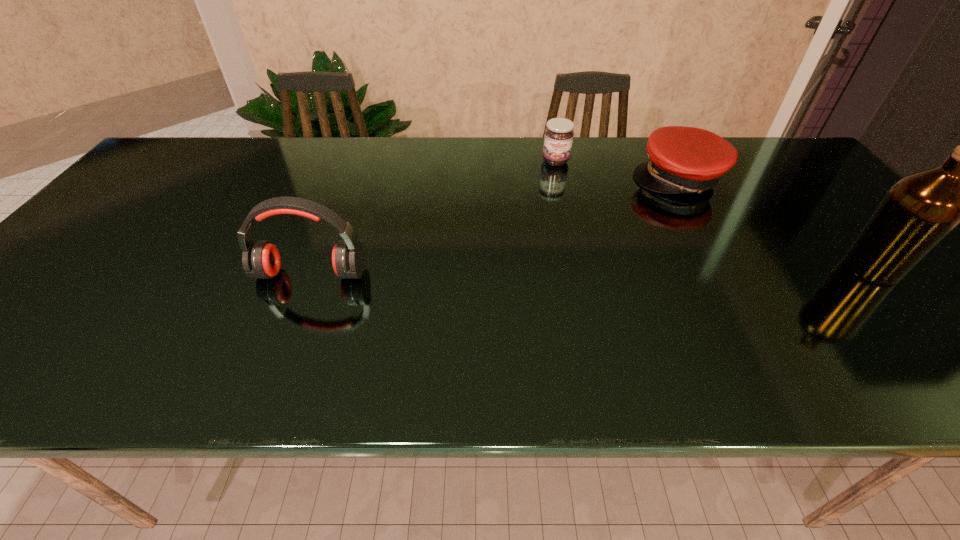
This screenshot has width=960, height=540. I want to click on earphone, so click(x=261, y=260).

I want to click on the leftmost object, so click(x=261, y=260).

Identify the location of the tallest object. (917, 212).

Image resolution: width=960 pixels, height=540 pixels. Find the location of `olive oil`. olive oil is located at coordinates (917, 212).

You are a GUI agent. You are given a task and a screenshot of the screen. Output one action in this format:
    pyautogui.click(x=<x>, y=<y>)
    Task: Click on the cap
    The image size is (960, 540).
    Given the screenshot: What is the action you would take?
    pyautogui.click(x=682, y=159)

The image size is (960, 540). Identify the location of jam. (558, 138).

Where is `free location located 0.100m on the ear cups of the earphone`? The height and width of the screenshot is (540, 960). free location located 0.100m on the ear cups of the earphone is located at coordinates (292, 322).

I want to click on vacant space located 0.270m at the front of the third object from left to right where the visor is located, so click(x=608, y=245).

Identify the location of vacant space positioned 0.390m at the front of the third object from left to right where the visor is located. (581, 271).

You are a GUI agent. You are given a task and a screenshot of the screen. Output one action in this format:
    pyautogui.click(x=<x>, y=<y>)
    Task: Click on the vacant region located 0.220m at the front of the third object from left to right where the visor is located
    The width and height of the screenshot is (960, 540).
    Given the screenshot: What is the action you would take?
    pyautogui.click(x=617, y=235)